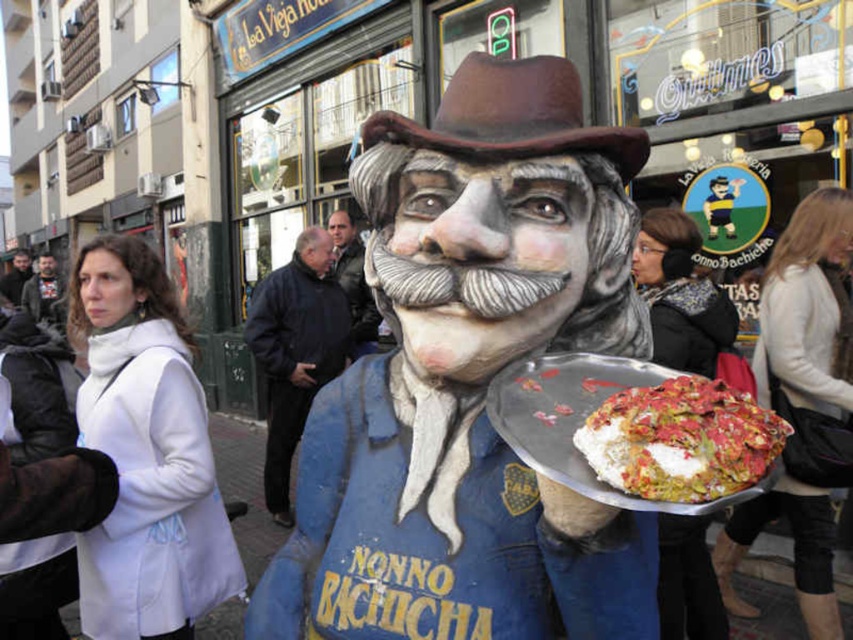
You are a photographer trying to capture both the brown felt cowboy hat at center and the dark gray fabric jacket at left in a single shot. Based on their positions, which object should you adjust your camera to focus on first to ensure both are in the frame?

The dark gray fabric jacket at left should be focused on first since the brown felt cowboy hat at center is to the right of it, meaning the jacket is closer to the left edge of the frame. By centering the jacket in the viewfinder and panning right to include the hat, both subjects can be captured effectively.

You are standing in the street scene and see the brown felt cowboy hat at center. Can you determine its exact position using coordinates?

The brown felt cowboy hat at center is located at point (512,116).

You are a fashion designer observing the lively street scene. You notice the brown felt cowboy hat at center and the dark gray fabric jacket at left. Which of these two items is smaller in size?

The brown felt cowboy hat at center has a smaller size compared to the dark gray fabric jacket at left, so the brown felt cowboy hat at center is smaller.